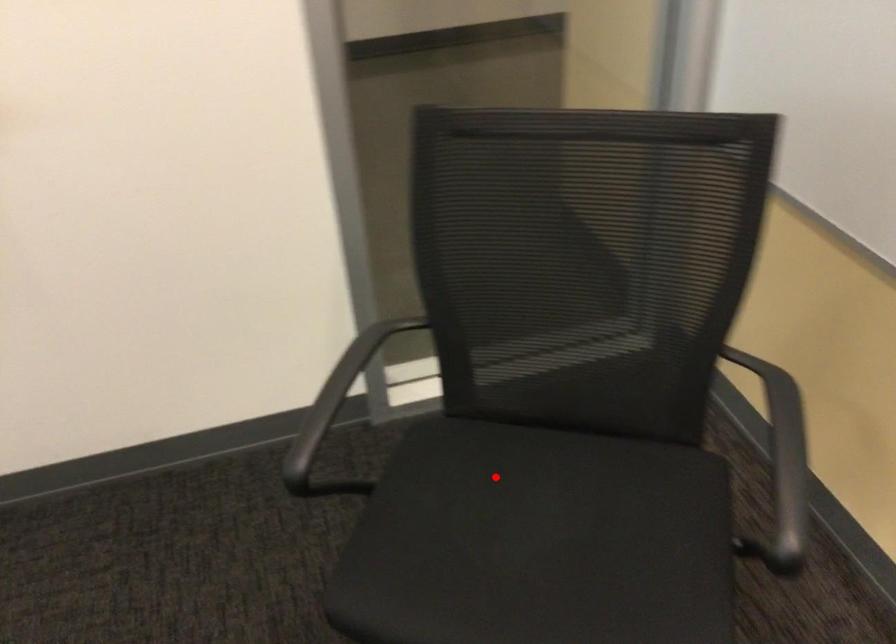
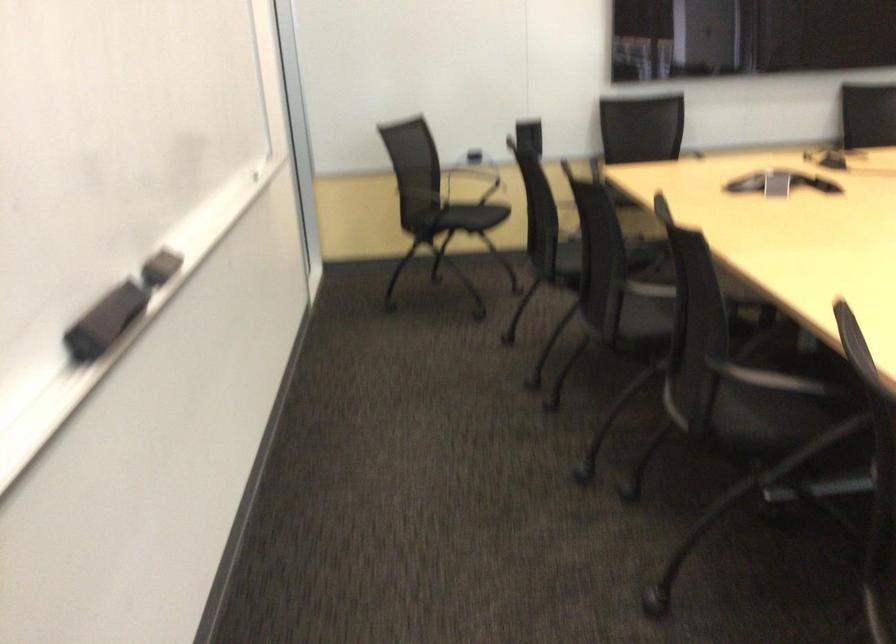
Where in the second image is the point corresponding to the highlighted location from the first image?

(448, 216)